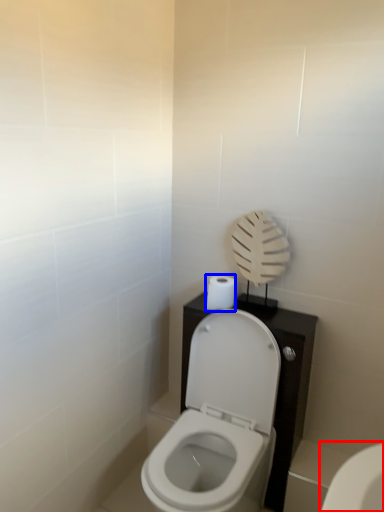
Question: Which object appears farthest to the camera in this image, toilet (highlighted by a red box) or toilet paper (highlighted by a blue box)?

Choices:
 (A) toilet
 (B) toilet paper

Answer: (B)